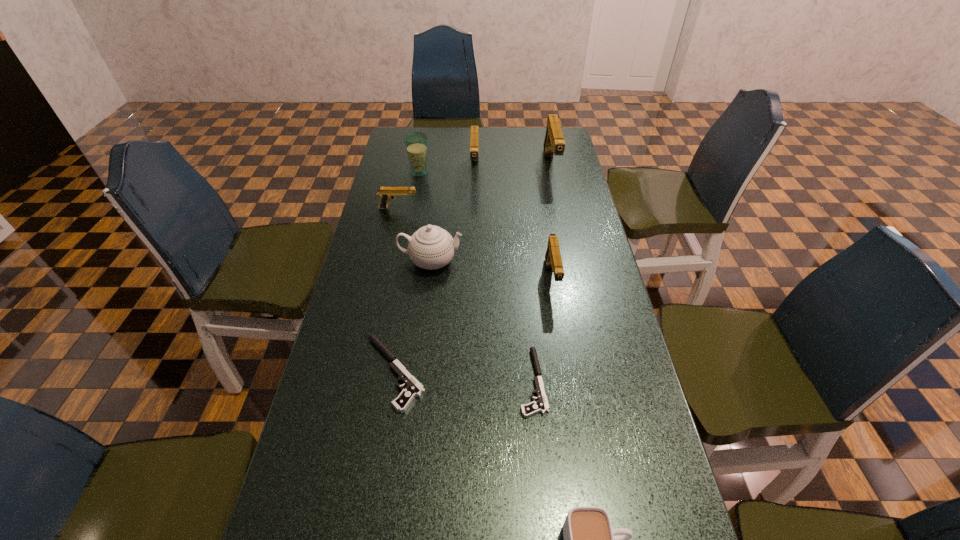
The width and height of the screenshot is (960, 540). In order to click on free space located 0.090m on the front-facing side of the bigger black pistol in this screenshot , I will do `click(324, 373)`.

Where is `vacant space situated on the front-facing side of the bigger black pistol`? The image size is (960, 540). vacant space situated on the front-facing side of the bigger black pistol is located at coordinates click(328, 373).

Locate an element on the screen. free space located 0.250m on the front-facing side of the shortest pistol is located at coordinates (413, 382).

Locate an element on the screen. The width and height of the screenshot is (960, 540). free space located 0.400m on the front-facing side of the shortest pistol is located at coordinates (349, 382).

Locate an element on the screen. This screenshot has width=960, height=540. vacant space positioned 0.390m on the front-facing side of the shortest pistol is located at coordinates (353, 382).

This screenshot has height=540, width=960. What are the coordinates of `glass located in the left edge section of the desktop` in the screenshot? It's located at (416, 143).

Find the location of a particular element. Image resolution: width=960 pixels, height=540 pixels. chinaware present at the left edge is located at coordinates (431, 247).

You are a GUI agent. You are given a task and a screenshot of the screen. Output one action in this format:
    pyautogui.click(x=<x>, y=<y>)
    Task: Click on the object present at the far right corner
    The image size is (960, 540).
    Given the screenshot: What is the action you would take?
    pyautogui.click(x=554, y=144)

You are a GUI agent. You are given a task and a screenshot of the screen. Output one action in this format:
    pyautogui.click(x=<x>, y=<y>)
    Task: Click on the vacant space at the left edge
    
    Given the screenshot: What is the action you would take?
    pyautogui.click(x=347, y=427)

The image size is (960, 540). Find the location of `vacant area at the right edge of the desktop`. vacant area at the right edge of the desktop is located at coordinates (549, 186).